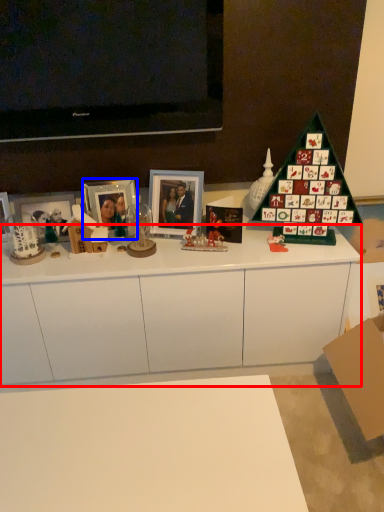
Question: Which point is further to the camera, cabinetry (highlighted by a red box) or picture frame (highlighted by a blue box)?

Choices:
 (A) cabinetry
 (B) picture frame

Answer: (B)